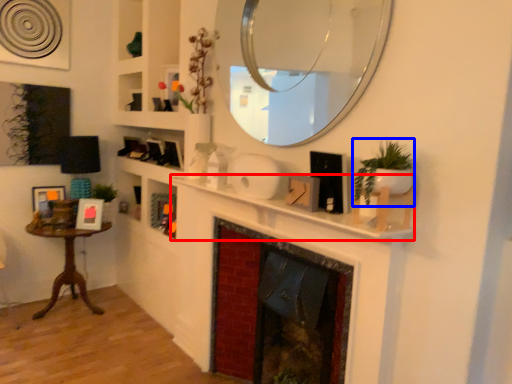
Question: Which of the following is the farthest to the observer, mantle (highlighted by a red box) or plant (highlighted by a blue box)?

Choices:
 (A) mantle
 (B) plant

Answer: (A)